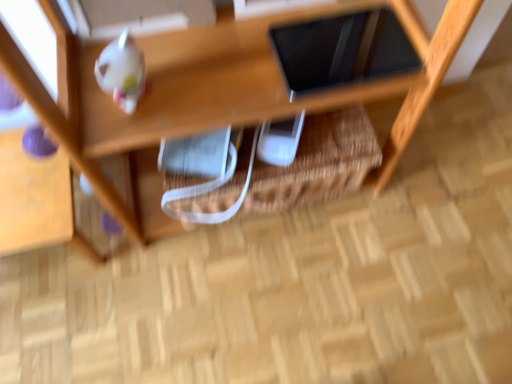
Question: Is point (224, 201) positioned closer to the camera than point (72, 152)?

Choices:
 (A) farther
 (B) closer

Answer: (A)

Question: From a real-world perspective, is woven straw basket at center positioned above or below wooden shelf at upper center?

Choices:
 (A) below
 (B) above

Answer: (B)

Question: Considering the real-world distances, which object is closest to the wooden shelf at upper center?

Choices:
 (A) white glossy teapot at upper left
 (B) woven straw basket at center
 (C) black glossy tablet at upper center

Answer: (B)

Question: Which of these objects is positioned farthest from the black glossy tablet at upper center?

Choices:
 (A) woven straw basket at center
 (B) white glossy teapot at upper left
 (C) wooden shelf at upper center

Answer: (B)